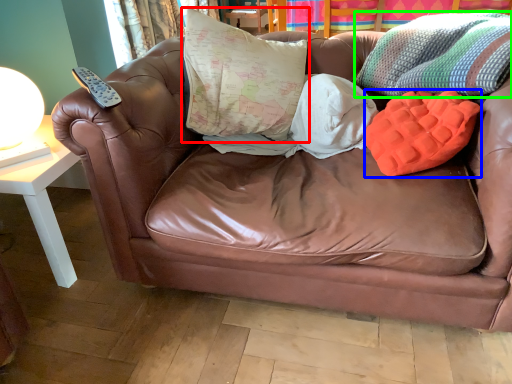
Question: Which object is the closest to the pillow (highlighted by a red box)? Choose among these: pillow (highlighted by a blue box) or throw pillow (highlighted by a green box).

Choices:
 (A) pillow
 (B) throw pillow

Answer: (B)